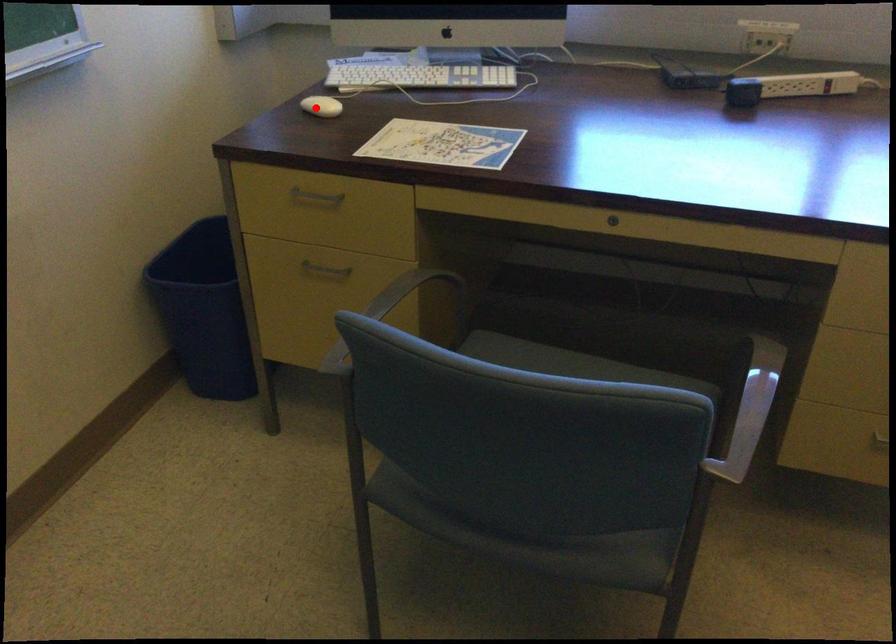
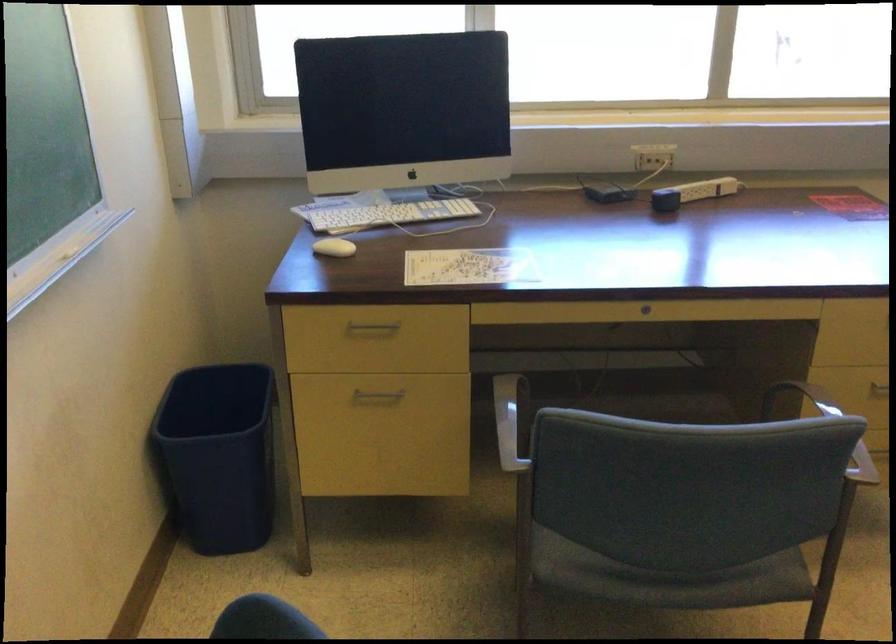
Locate, in the second image, the point that corresponds to the highlighted location in the first image.

(333, 247)